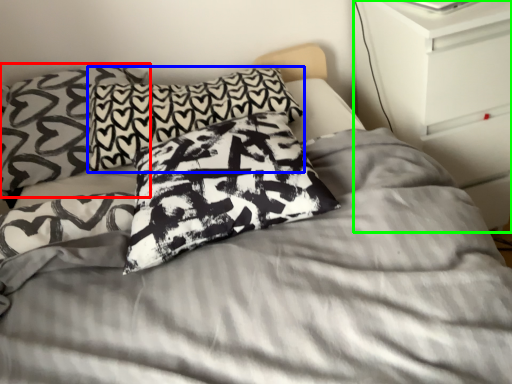
Question: Based on their relative distances, which object is nearer to pillow (highlighted by a red box)? Choose from pillow (highlighted by a blue box) and dresser (highlighted by a green box).

Choices:
 (A) pillow
 (B) dresser

Answer: (A)